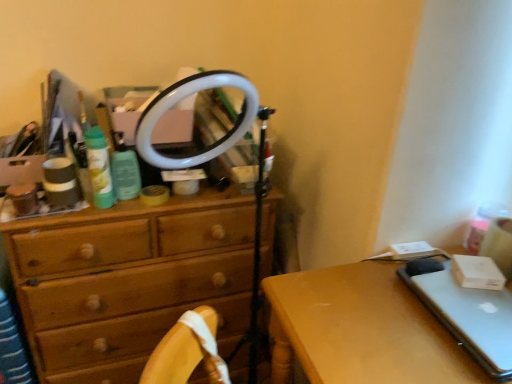
What is the approximate width of wooden drawer at center?

wooden drawer at center is 15.24 centimeters wide.

Locate an element on the screen. wooden chest of drawers at center is located at coordinates (128, 280).

You are a GUI agent. You are given a task and a screenshot of the screen. Output one action in this format:
    pyautogui.click(x=<x>, y=<y>)
    Task: Click on the silver metallic laptop at right
    The width and height of the screenshot is (512, 384).
    Given the screenshot: What is the action you would take?
    pyautogui.click(x=466, y=313)

From the image's perspective, which object appears higher, wooden drawer at center or wooden chest of drawers at center?

wooden chest of drawers at center appears higher in the image.

The height and width of the screenshot is (384, 512). Identify the location of chest of drawers on the left of wooden drawer at center. (128, 280).

Is wooden drawer at center looking in the opposite direction of wooden chest of drawers at center?

No, wooden drawer at center is not facing away from wooden chest of drawers at center.

The image size is (512, 384). I want to click on laptop positioned vertically above the wooden chest of drawers at center (from a real-world perspective), so click(466, 313).

From their relative heights in the image, would you say silver metallic laptop at right is taller or shorter than wooden chest of drawers at center?

silver metallic laptop at right is shorter than wooden chest of drawers at center.

How much distance is there between silver metallic laptop at right and wooden chest of drawers at center?

A distance of 31.88 inches exists between silver metallic laptop at right and wooden chest of drawers at center.

Between silver metallic laptop at right and wooden chest of drawers at center, which one has smaller width?

With smaller width is silver metallic laptop at right.

You are a GUI agent. You are given a task and a screenshot of the screen. Output one action in this format:
    pyautogui.click(x=<x>, y=<y>)
    Task: Click on the desk above the wooden chest of drawers at center (from a real-world perspective)
    Image resolution: width=512 pixels, height=384 pixels.
    Given the screenshot: What is the action you would take?
    pyautogui.click(x=360, y=329)

Is wooden chest of drawers at center taller or shorter than silver metallic desk at lower right?

Clearly, wooden chest of drawers at center is taller compared to silver metallic desk at lower right.

Which object is further away from the camera, wooden chest of drawers at center or silver metallic desk at lower right?

wooden chest of drawers at center is further away from the camera.

In terms of size, does wooden chest of drawers at center appear bigger or smaller than silver metallic desk at lower right?

wooden chest of drawers at center is bigger than silver metallic desk at lower right.

From a real-world perspective, is silver metallic desk at lower right over wooden chest of drawers at center?

Yes.

How much distance is there between silver metallic desk at lower right and wooden chest of drawers at center?

silver metallic desk at lower right is 50.02 centimeters away from wooden chest of drawers at center.

Is silver metallic desk at lower right located outside wooden chest of drawers at center?

Yes, silver metallic desk at lower right is located beyond the bounds of wooden chest of drawers at center.

Between point (353, 290) and point (49, 354), which one is positioned behind?

The point (49, 354) is behind.

Who is shorter, silver metallic desk at lower right or silver metallic laptop at right?

silver metallic laptop at right.

From the image's perspective, between silver metallic desk at lower right and silver metallic laptop at right, who is located below?

silver metallic desk at lower right, from the image's perspective.

Can you confirm if silver metallic desk at lower right is positioned to the left of silver metallic laptop at right?

Yes, silver metallic desk at lower right is to the left of silver metallic laptop at right.

Locate an element on the screen. laptop above the silver metallic desk at lower right (from the image's perspective) is located at coordinates (466, 313).

Does point (377, 373) appear closer or farther from the camera than point (245, 328)?

Point (377, 373).

From the picture: Which of these two, silver metallic desk at lower right or wooden drawer at center, is bigger?

Bigger between the two is silver metallic desk at lower right.

Can you confirm if silver metallic desk at lower right is positioned to the right of wooden drawer at center?

Indeed, silver metallic desk at lower right is positioned on the right side of wooden drawer at center.

Are silver metallic laptop at right and wooden drawer at center making contact?

No.

At what (x,y) coordinates should I click in order to perform the action: click on laptop located on the right of wooden drawer at center. Please return your answer as a coordinate pair (x, y). The width and height of the screenshot is (512, 384). Looking at the image, I should click on [x=466, y=313].

Is point (469, 344) farther from camera compared to point (97, 361)?

That is False.

From the image's perspective, is silver metallic laptop at right below wooden drawer at center?

Actually, silver metallic laptop at right appears above wooden drawer at center in the image.

Identify the location of chest of drawers behind the wooden drawer at center. The height and width of the screenshot is (384, 512). (128, 280).

Locate an element on the screen. laptop lying above the wooden chest of drawers at center (from the image's perspective) is located at coordinates (466, 313).

Looking at the image, which one is located closer to silver metallic desk at lower right, silver metallic laptop at right or wooden drawer at center?

silver metallic laptop at right lies closer to silver metallic desk at lower right than the other object.

From the image, which object appears to be nearer to silver metallic desk at lower right, wooden drawer at center or wooden chest of drawers at center?

wooden chest of drawers at center is positioned closer to the anchor silver metallic desk at lower right.

When comparing their distances from wooden chest of drawers at center, does silver metallic desk at lower right or wooden drawer at center seem further?

silver metallic desk at lower right lies further to wooden chest of drawers at center than the other object.

Considering their positions, is silver metallic desk at lower right positioned closer to wooden drawer at center than silver metallic laptop at right?

silver metallic desk at lower right is closer to wooden drawer at center.

Based on the photo, considering their positions, is wooden drawer at center positioned closer to silver metallic laptop at right than wooden chest of drawers at center?

The object closer to silver metallic laptop at right is wooden chest of drawers at center.

Which object lies nearer to the anchor point wooden drawer at center, wooden chest of drawers at center or silver metallic laptop at right?

The object closer to wooden drawer at center is wooden chest of drawers at center.

When comparing their distances from silver metallic laptop at right, does silver metallic desk at lower right or wooden chest of drawers at center seem closer?

The object closer to silver metallic laptop at right is silver metallic desk at lower right.

Considering their positions, is silver metallic laptop at right positioned closer to wooden drawer at center than wooden chest of drawers at center?

wooden chest of drawers at center is closer to wooden drawer at center.

Locate an element on the screen. drawer between wooden chest of drawers at center and silver metallic laptop at right from left to right is located at coordinates tap(130, 334).

Image resolution: width=512 pixels, height=384 pixels. Find the location of `desk between wooden drawer at center and silver metallic laptop at right`. desk between wooden drawer at center and silver metallic laptop at right is located at coordinates (360, 329).

I want to click on desk between wooden chest of drawers at center and silver metallic laptop at right from left to right, so click(360, 329).

At what (x,y) coordinates should I click in order to perform the action: click on drawer between wooden chest of drawers at center and silver metallic desk at lower right. Please return your answer as a coordinate pair (x, y). This screenshot has height=384, width=512. Looking at the image, I should click on (130, 334).